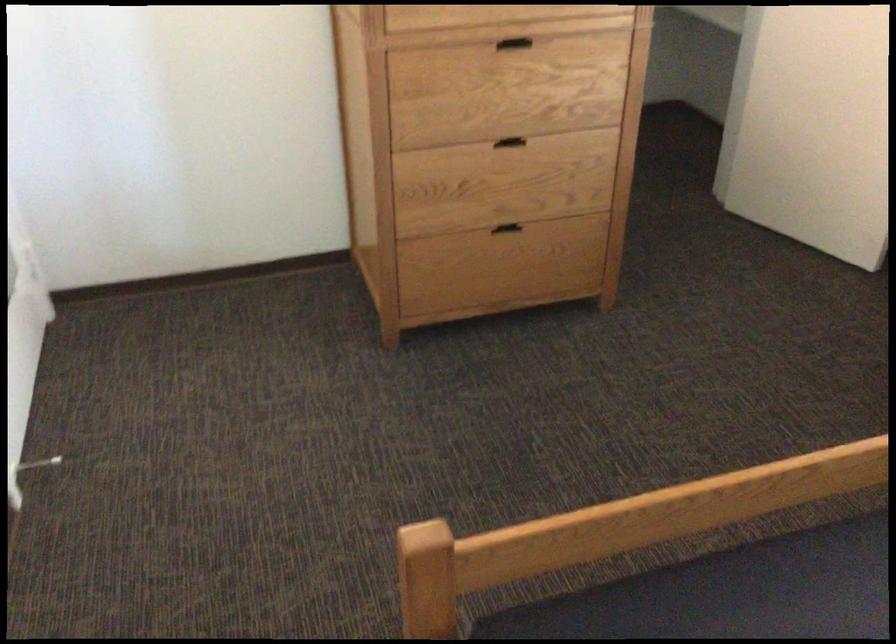
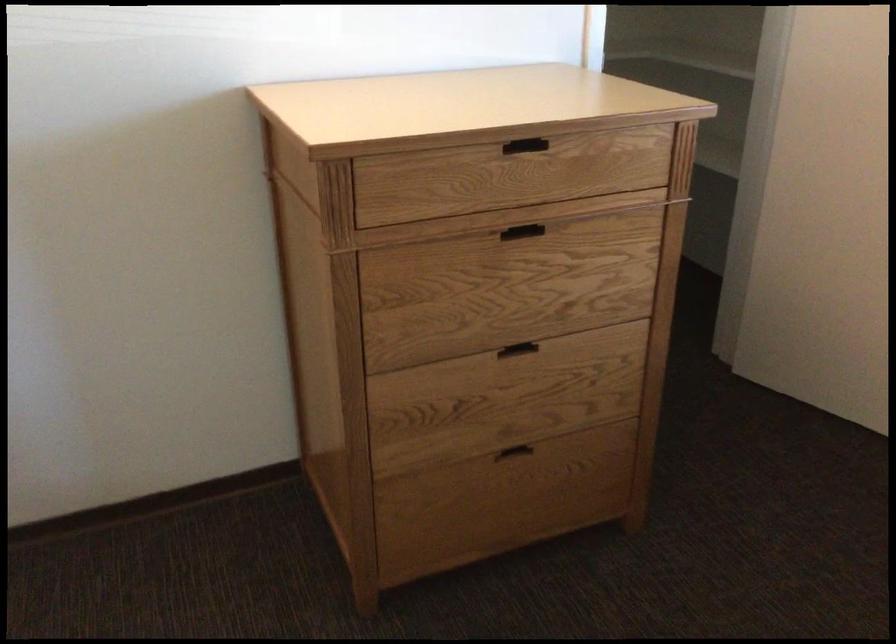
Question: The first image is from the beginning of the video and the second image is from the end. How did the camera likely rotate when shooting the video?

Choices:
 (A) Left
 (B) Right
 (C) Up
 (D) Down

Answer: (C)